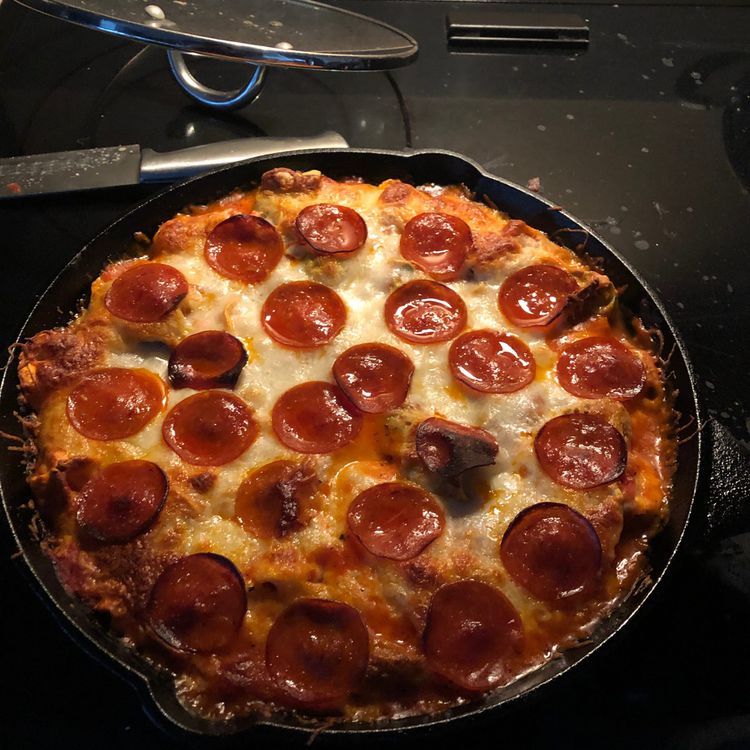
You are a GUI agent. You are given a task and a screenshot of the screen. Output one action in this format:
    pyautogui.click(x=<x>, y=<y>)
    Task: Click on the table
    
    Given the screenshot: What is the action you would take?
    pyautogui.click(x=606, y=168)